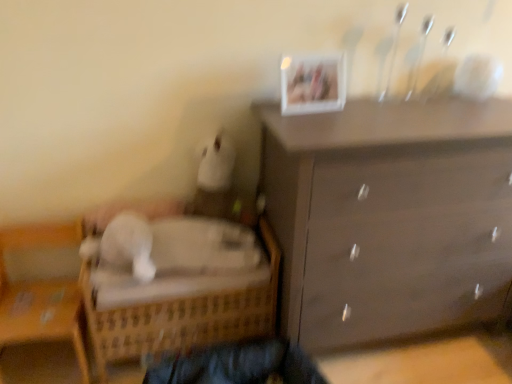
Question: Is woven wood bed at lower left shorter than wooden wicker basket at lower left?

Choices:
 (A) yes
 (B) no

Answer: (A)

Question: Is woven wood bed at lower left aimed at wooden wicker basket at lower left?

Choices:
 (A) no
 (B) yes

Answer: (A)

Question: Is the position of woven wood bed at lower left more distant than that of wooden wicker basket at lower left?

Choices:
 (A) yes
 (B) no

Answer: (A)

Question: Can you confirm if woven wood bed at lower left is bigger than wooden wicker basket at lower left?

Choices:
 (A) no
 (B) yes

Answer: (B)

Question: Is wooden wicker basket at lower left at the back of woven wood bed at lower left?

Choices:
 (A) yes
 (B) no

Answer: (B)

Question: Is woven wood bed at lower left wider or thinner than wooden wicker basket at lower left?

Choices:
 (A) thin
 (B) wide

Answer: (B)

Question: Is point (245, 306) positioned closer to the camera than point (59, 241)?

Choices:
 (A) farther
 (B) closer

Answer: (B)

Question: Considering their positions, is woven wood bed at lower left located in front of or behind wooden wicker basket at lower left?

Choices:
 (A) behind
 (B) front

Answer: (A)

Question: From the image's perspective, is woven wood bed at lower left located above or below wooden wicker basket at lower left?

Choices:
 (A) below
 (B) above

Answer: (B)

Question: Considering the positions of wooden wicker basket at lower left and woven wood bed at lower left in the image, is wooden wicker basket at lower left taller or shorter than woven wood bed at lower left?

Choices:
 (A) tall
 (B) short

Answer: (A)

Question: Do you think wooden wicker basket at lower left is within woven wood bed at lower left, or outside of it?

Choices:
 (A) outside
 (B) inside

Answer: (A)

Question: Considering the positions of point (16, 357) and point (268, 284), is point (16, 357) closer or farther from the camera than point (268, 284)?

Choices:
 (A) closer
 (B) farther

Answer: (B)

Question: From a real-world perspective, is wooden wicker basket at lower left above or below woven wood bed at lower left?

Choices:
 (A) below
 (B) above

Answer: (B)

Question: Is point (70, 296) positioned closer to the camera than point (311, 62)?

Choices:
 (A) closer
 (B) farther

Answer: (B)

Question: Do you think wooden wicker basket at lower left is within white plastic picture frame at upper center, or outside of it?

Choices:
 (A) outside
 (B) inside

Answer: (A)